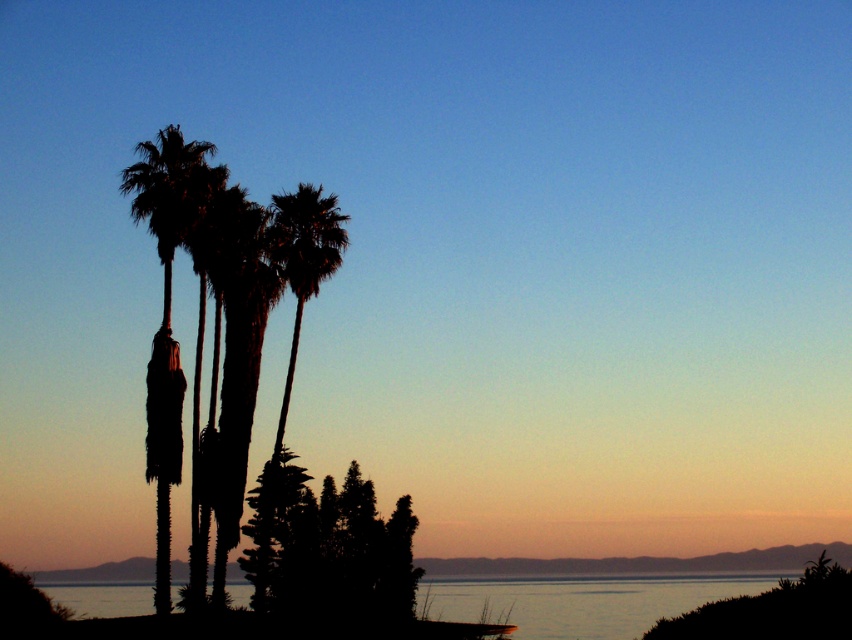
You are standing on the beach and see the transparent water at lower center and the silhouette palm tree at center. Which object is closer to your right side?

The transparent water at lower center is closer to your right side because it is positioned to the right of the silhouette palm tree at center.

You are a photographer trying to capture the sunset scene. You want to focus on the transparent water at lower center while still showing the silhouette leafy tree at center in the background. Is the arrangement of the objects suitable for this composition?

Yes, the transparent water at lower center is behind the silhouette leafy tree at center, so focusing on the water will naturally place the tree in the background, creating the desired composition.

You are standing at the edge of a beach looking at the sunset scene. You see the transparent water at lower center and the silhouette palm tree at center. Which object is closer to you?

The transparent water at lower center is closer to the viewer than the silhouette palm tree at center.